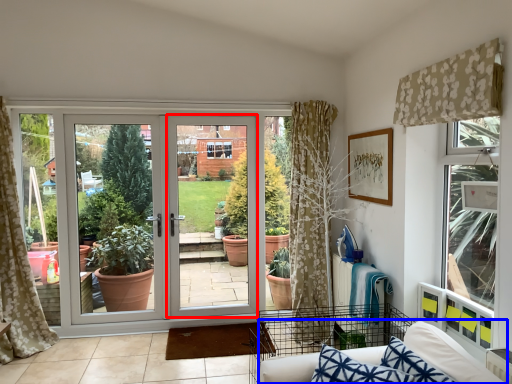
Question: Which object is closer to the camera taking this photo, screen door (highlighted by a red box) or couch (highlighted by a blue box)?

Choices:
 (A) screen door
 (B) couch

Answer: (B)